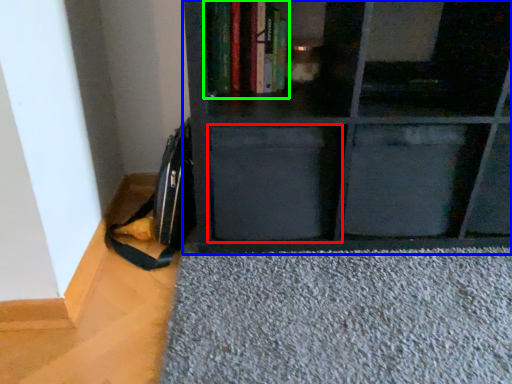
Question: Estimate the real-world distances between objects in this image. Which object is closer to drawer (highlighted by a red box), shelf (highlighted by a blue box) or book (highlighted by a green box)?

Choices:
 (A) shelf
 (B) book

Answer: (A)